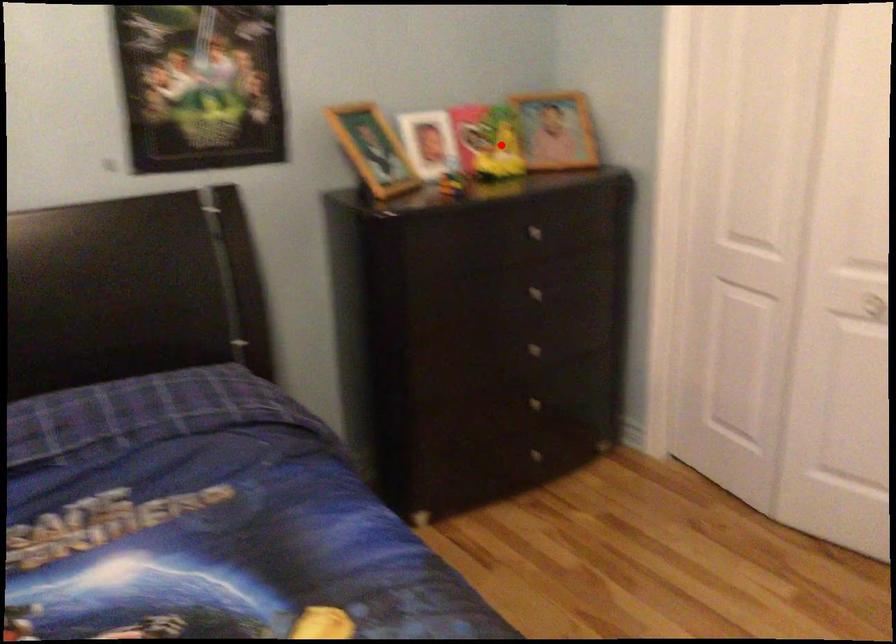
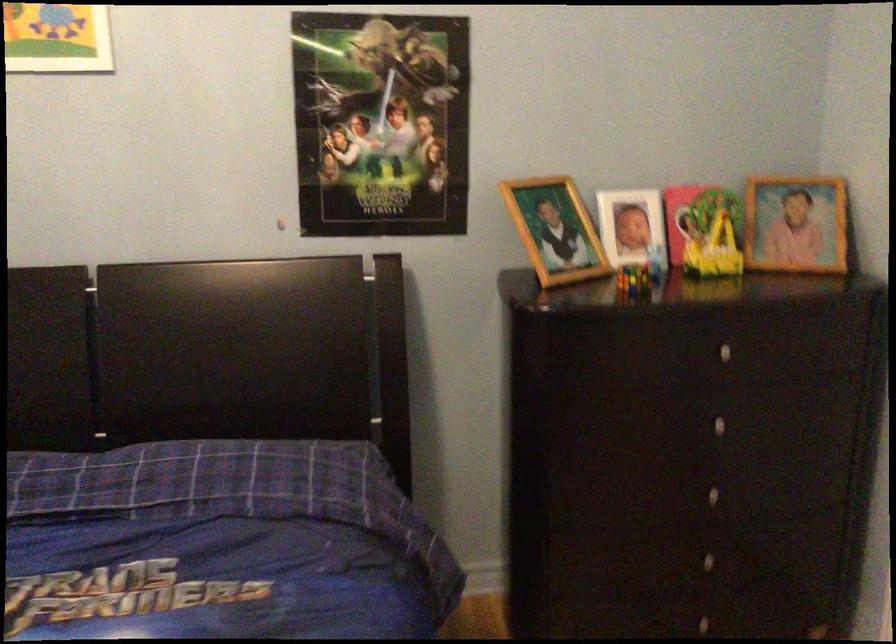
Question: I am providing you with two images of the same scene from different viewpoints. A red point is marked on the first image. Can you still see the location of the red point in image 2?

Choices:
 (A) Yes
 (B) No

Answer: (A)